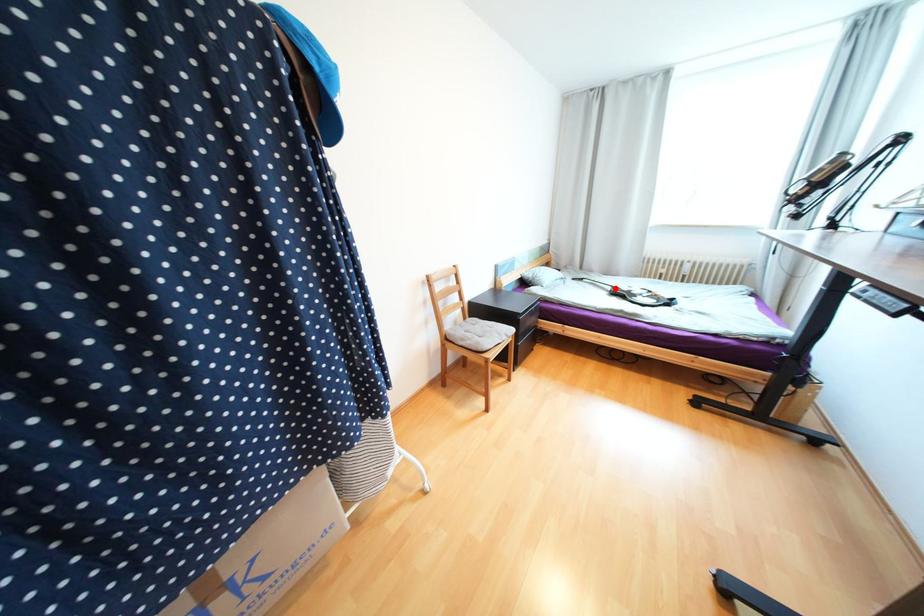
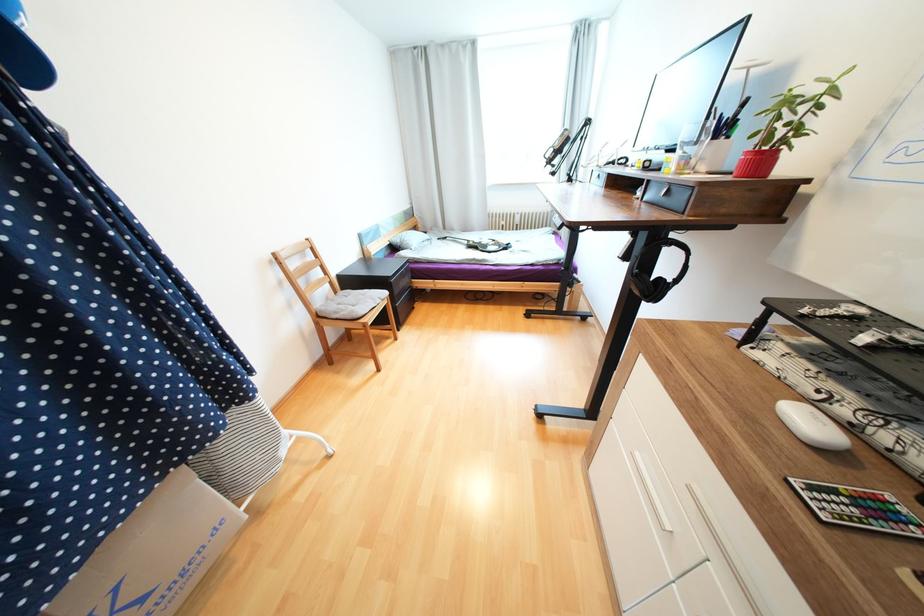
Locate, in the second image, the point that corresponds to the highlighted location in the first image.

(471, 243)